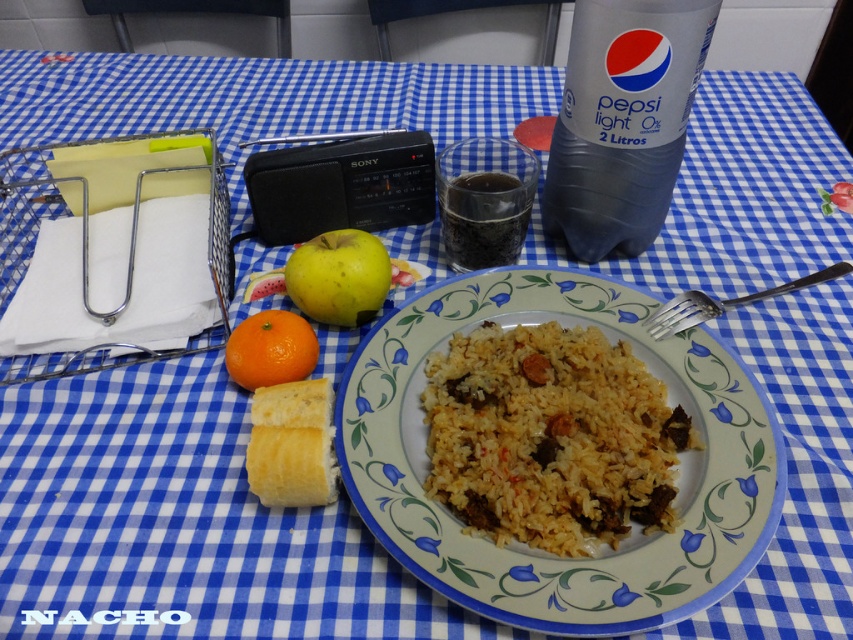
Which is behind, point (433, 403) or point (425, 204)?

The point (425, 204) is more distant.

The image size is (853, 640). What do you see at coordinates (550, 436) in the screenshot? I see `yellowish rice at center` at bounding box center [550, 436].

Which is in front, point (605, 401) or point (247, 193)?

Point (605, 401)

The height and width of the screenshot is (640, 853). What are the coordinates of `yellowish rice at center` in the screenshot? It's located at (550, 436).

Is point (430, 180) positioned in front of point (293, 426)?

No, (430, 180) is further to viewer.

Which of these two, black plastic radio at center or yellow bread at center, stands shorter?

yellow bread at center is shorter.

Between point (260, 172) and point (297, 493), which one is positioned behind?

Positioned behind is point (260, 172).

This screenshot has width=853, height=640. Find the location of `black plastic radio at center`. black plastic radio at center is located at coordinates (340, 186).

Can you confirm if transparent glass at center is smaller than silver/black metal fork at right?

Correct, transparent glass at center occupies less space than silver/black metal fork at right.

From the picture: Measure the distance from transparent glass at center to silver/black metal fork at right.

The distance of transparent glass at center from silver/black metal fork at right is 5.72 inches.

Between point (527, 200) and point (732, 300), which one is positioned in front?

Point (527, 200)

Find the location of `transparent glass at center`. transparent glass at center is located at coordinates (485, 218).